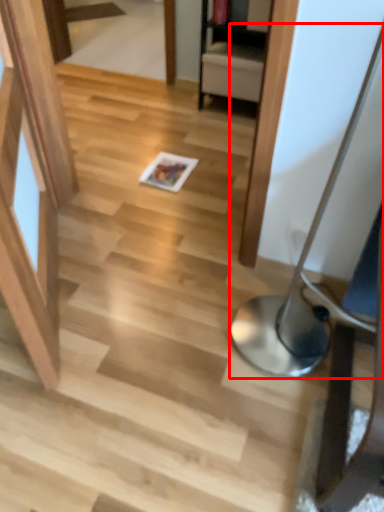
Question: From the image's perspective, what is the correct spatial positioning of table lamp (annotated by the red box) in reference to magazine?

Choices:
 (A) above
 (B) below

Answer: (B)